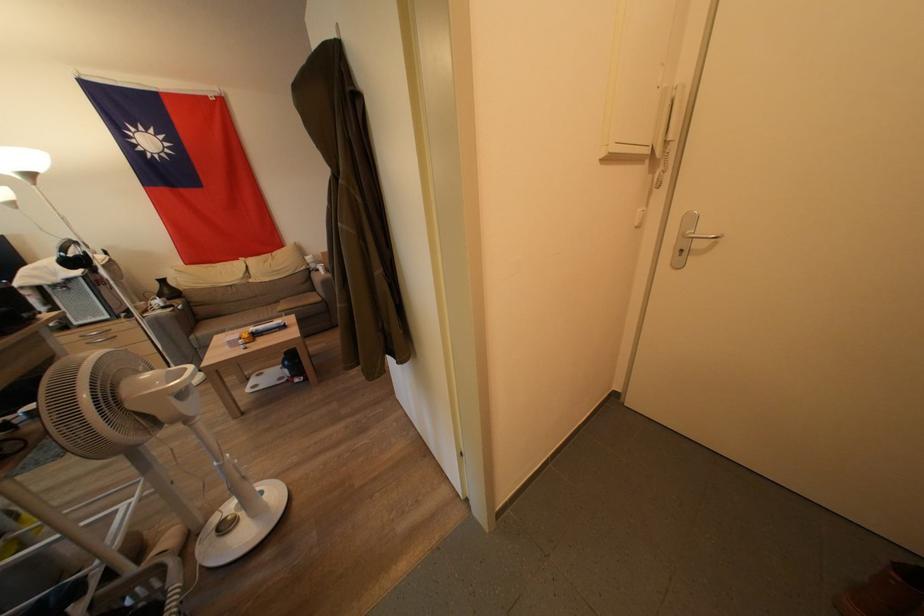
Where would you pull the silver door handle? Please return your answer as a coordinate pair (x, y).

(699, 238)